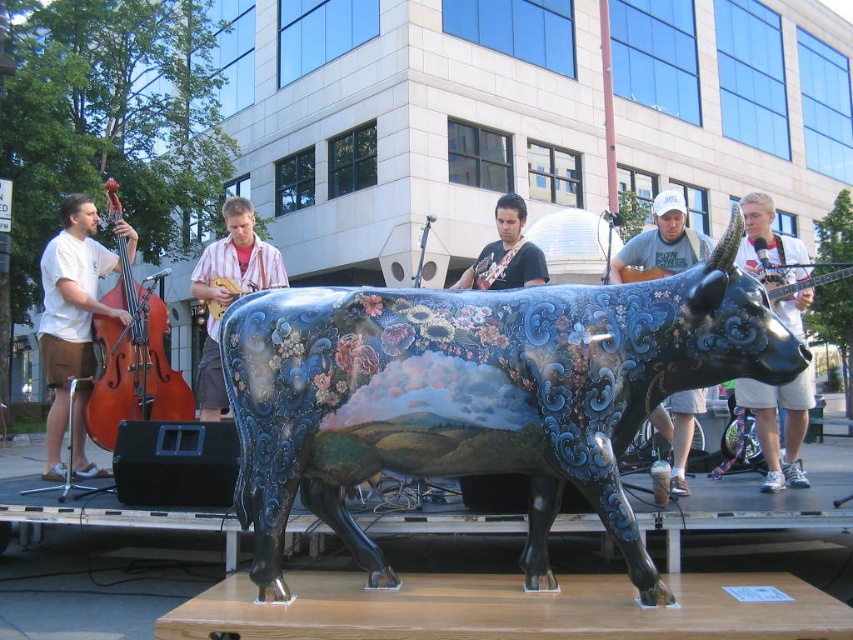
Can you confirm if brown wooden cello at left is positioned below shiny black guitar at center?

Yes, brown wooden cello at left is below shiny black guitar at center.

Measure the distance between brown wooden cello at left and camera.

5.01 meters

Where is `brown wooden cello at left`? The height and width of the screenshot is (640, 853). brown wooden cello at left is located at coordinates (132, 362).

Does glossy painted cow at center lie behind shiny black guitar at center?

No, it is in front of shiny black guitar at center.

Between glossy painted cow at center and shiny black guitar at center, which one has more height?

Standing taller between the two is glossy painted cow at center.

Find the location of a particular element. The width and height of the screenshot is (853, 640). glossy painted cow at center is located at coordinates point(479,394).

Can you confirm if glossy painted cow at center is positioned below brown wooden cello at left?

Indeed, glossy painted cow at center is positioned under brown wooden cello at left.

Who is shorter, glossy painted cow at center or brown wooden cello at left?

glossy painted cow at center is shorter.

Describe the element at coordinates (479, 394) in the screenshot. I see `glossy painted cow at center` at that location.

You are a GUI agent. You are given a task and a screenshot of the screen. Output one action in this format:
    pyautogui.click(x=<x>, y=<y>)
    Task: Click on the glossy painted cow at center
    The image size is (853, 640).
    Given the screenshot: What is the action you would take?
    pyautogui.click(x=479, y=394)